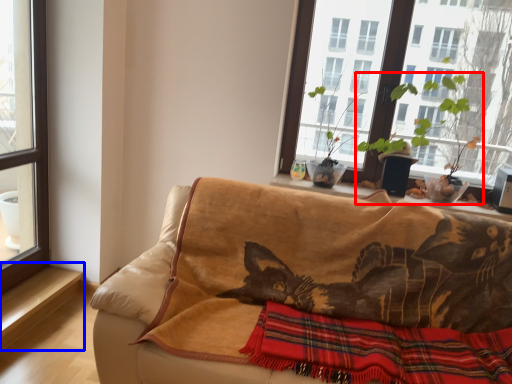
Question: Which object is closer to the camera taking this photo, houseplant (highlighted by a red box) or window sill (highlighted by a blue box)?

Choices:
 (A) houseplant
 (B) window sill

Answer: (A)